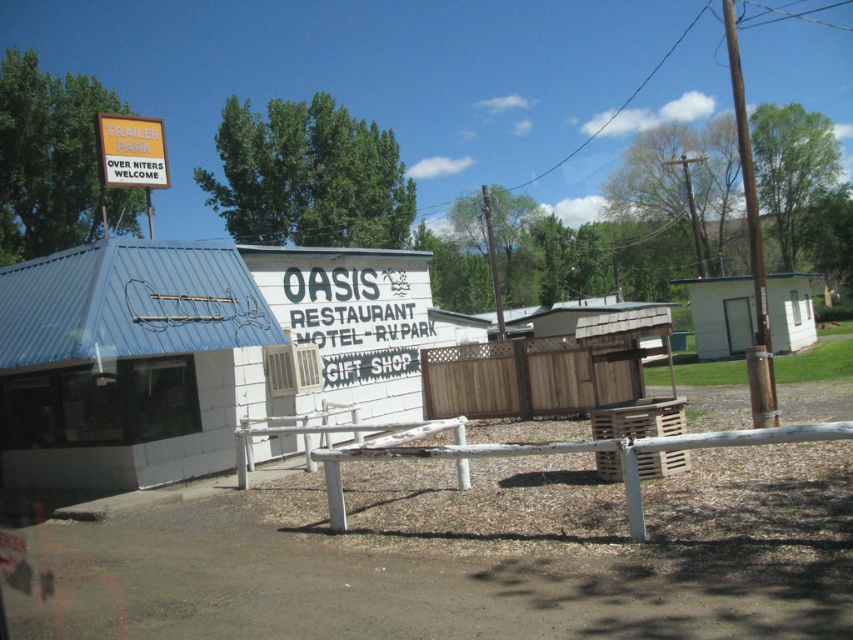
Between brown wood fence at center and white wood fence at center, which one is positioned lower?

white wood fence at center is below.

Does brown wood fence at center have a greater width compared to white wood fence at center?

Incorrect, brown wood fence at center's width does not surpass white wood fence at center's.

Which is in front, point (601, 401) or point (340, 488)?

Positioned in front is point (340, 488).

Identify the location of brown wood fence at center. This screenshot has height=640, width=853. coord(531,376).

Between brown wood fence at center and yellow plastic sign at upper left, which one is positioned lower?

brown wood fence at center is below.

Does point (596, 372) lie in front of point (166, 182)?

That is False.

The image size is (853, 640). What do you see at coordinates (531, 376) in the screenshot?
I see `brown wood fence at center` at bounding box center [531, 376].

The image size is (853, 640). Find the location of `brown wood fence at center`. brown wood fence at center is located at coordinates (531, 376).

Between point (351, 448) and point (132, 116), which one is positioned behind?

The point (132, 116) is more distant.

Does white wood fence at center come behind yellow plastic sign at upper left?

That is False.

You are a GUI agent. You are given a task and a screenshot of the screen. Output one action in this format:
    pyautogui.click(x=<x>, y=<y>)
    Task: Click on the white wood fence at center
    The image size is (853, 640).
    Given the screenshot: What is the action you would take?
    pyautogui.click(x=519, y=452)